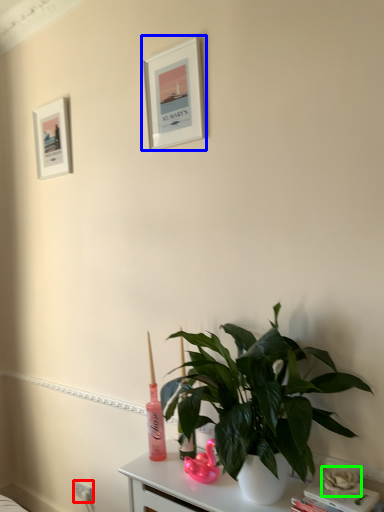
Question: Considering the real-world distances, which object is farthest from electric outlet (highlighted by a red box)? picture frame (highlighted by a blue box) or flower (highlighted by a green box)?

Choices:
 (A) picture frame
 (B) flower

Answer: (A)